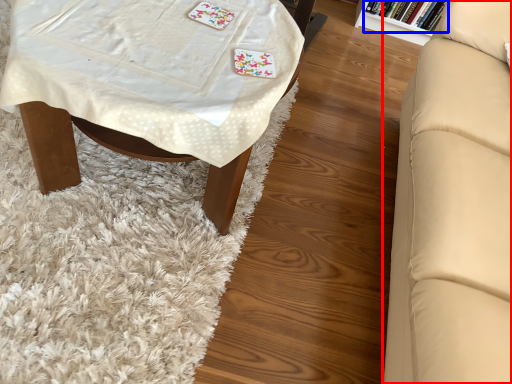
Question: Which of the following is the farthest to the observer, studio couch (highlighted by a red box) or book (highlighted by a blue box)?

Choices:
 (A) studio couch
 (B) book

Answer: (B)